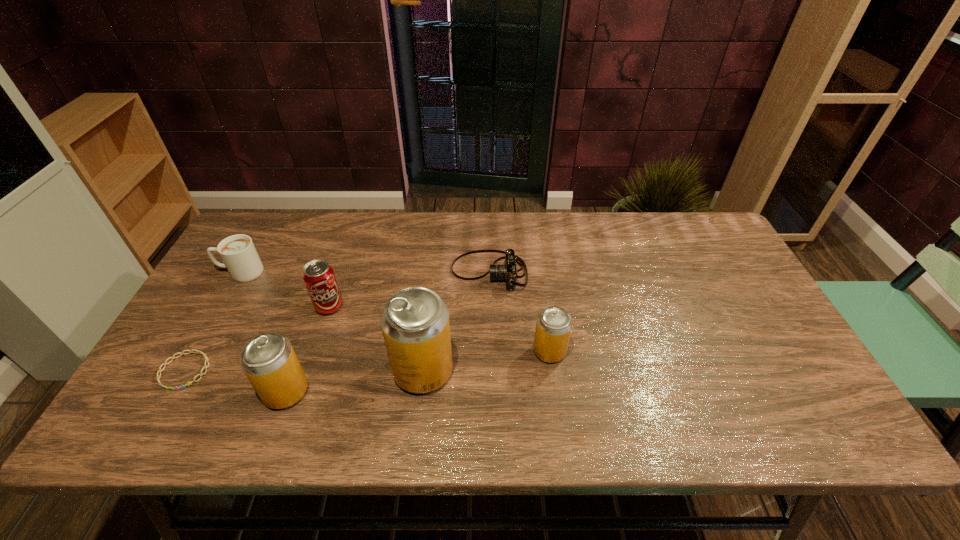
The image size is (960, 540). In the image, there is a desktop. What are the coordinates of `vacant space at the right edge` in the screenshot? It's located at (719, 289).

In the image, there is a desktop. Identify the location of free space at the far left corner. The image size is (960, 540). (270, 217).

The width and height of the screenshot is (960, 540). Identify the location of vacant point at the near left corner. click(x=220, y=380).

Locate an element on the screen. free space between the camera and the third shortest object is located at coordinates (365, 272).

Locate an element on the screen. The width and height of the screenshot is (960, 540). free spot between the bracelet and the third shortest object is located at coordinates (212, 321).

Where is `vacant area between the bracelet and the tallest soda`? Image resolution: width=960 pixels, height=540 pixels. vacant area between the bracelet and the tallest soda is located at coordinates (303, 371).

In order to click on vacant space in between the rightmost soda and the camera in this screenshot , I will do `click(519, 312)`.

Find the location of a particular element. free space between the second shortest object and the third soda from left to right is located at coordinates (456, 321).

The image size is (960, 540). In order to click on the sixth closest object to the second shortest object in this screenshot , I will do `click(190, 351)`.

Locate which object is the fifth closest to the sixth tallest object. Please provide its 2D coordinates. Your answer should be formatted as a tuple, i.e. [(x, y)], where the tuple contains the x and y coordinates of a point satisfying the conditions above.

[(238, 252)]